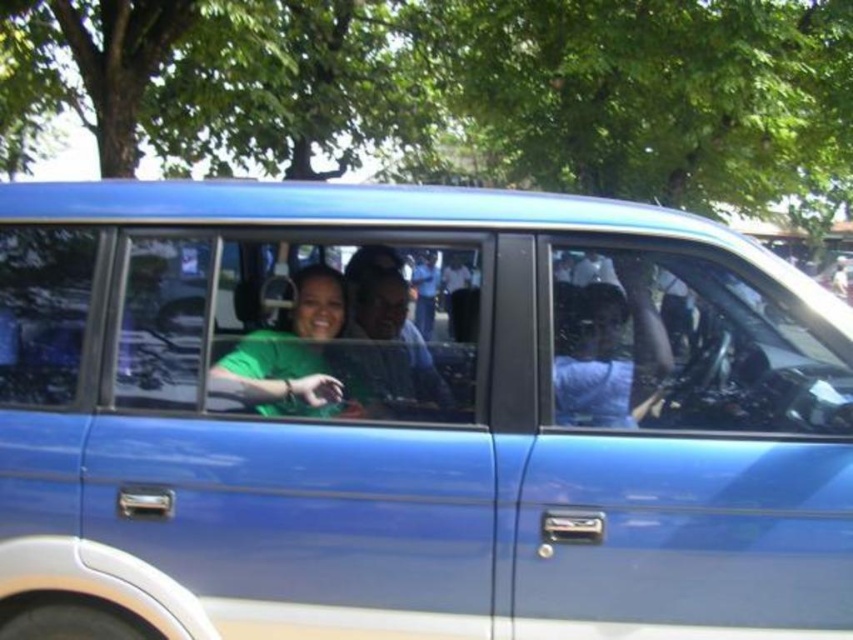
Consider the image. Which is below, transparent glass window at center or matte green shirt at center?

matte green shirt at center is lower down.

Between point (230, 282) and point (415, 387), which one is positioned in front?

Positioned in front is point (415, 387).

Find the location of `transparent glass window at center`. transparent glass window at center is located at coordinates (294, 326).

Which is in front, point (323, 280) or point (428, 401)?

Point (428, 401) is in front.

Does green matte shirt at center have a smaller size compared to matte green shirt at center?

Actually, green matte shirt at center might be larger than matte green shirt at center.

Describe the element at coordinates (291, 355) in the screenshot. This screenshot has width=853, height=640. I see `green matte shirt at center` at that location.

This screenshot has height=640, width=853. Identify the location of green matte shirt at center. (291, 355).

Does blue metallic minivan at center appear under transparent glass steering wheel at center?

Indeed, blue metallic minivan at center is positioned under transparent glass steering wheel at center.

Who is higher up, blue metallic minivan at center or transparent glass steering wheel at center?

→ transparent glass steering wheel at center is higher up.

Is point (373, 358) behind point (711, 328)?

Yes, it is.

You are a GUI agent. You are given a task and a screenshot of the screen. Output one action in this format:
    pyautogui.click(x=<x>, y=<y>)
    Task: Click on the blue metallic minivan at center
    This screenshot has width=853, height=640.
    Given the screenshot: What is the action you would take?
    pyautogui.click(x=412, y=419)